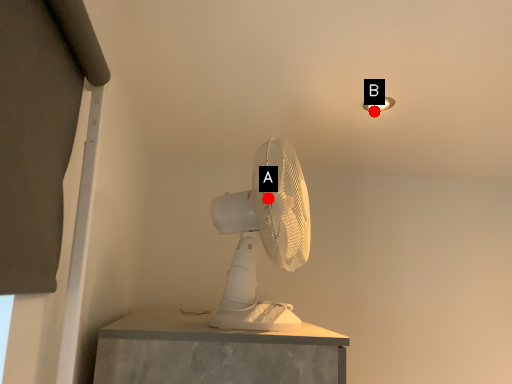
Question: Two points are circled on the image, labeled by A and B beside each circle. Which point is closer to the camera?

Choices:
 (A) A is closer
 (B) B is closer

Answer: (A)